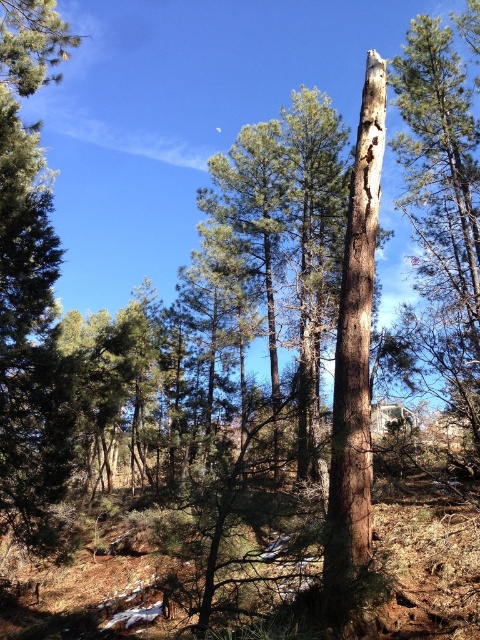
Question: Which object is farther from the camera taking this photo?

Choices:
 (A) brown rough tree trunk at center
 (B) smooth brown tree trunk at center

Answer: (B)

Question: Can you confirm if smooth brown tree trunk at center is wider than brown rough tree trunk at center?

Choices:
 (A) yes
 (B) no

Answer: (A)

Question: Is smooth brown tree trunk at center below brown rough tree trunk at center?

Choices:
 (A) no
 (B) yes

Answer: (A)

Question: From the image, what is the correct spatial relationship of smooth brown tree trunk at center in relation to brown rough tree trunk at center?

Choices:
 (A) below
 (B) above

Answer: (B)

Question: Which point appears closest to the camera in this image?

Choices:
 (A) (371, 136)
 (B) (444, 92)

Answer: (A)